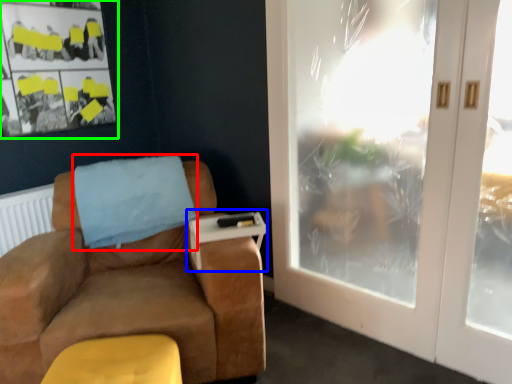
Question: Estimate the real-world distances between objects in this image. Which object is farther from blanket (highlighted by a red box), table (highlighted by a blue box) or bulletin board (highlighted by a green box)?

Choices:
 (A) table
 (B) bulletin board

Answer: (B)